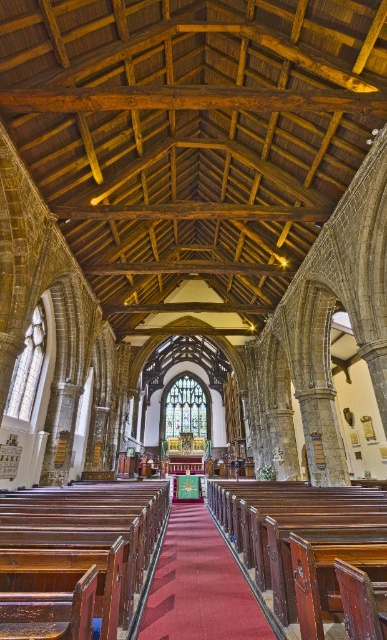
Question: Does polished wood church bench at center lie behind wooden polished bench at center?

Choices:
 (A) no
 (B) yes

Answer: (A)

Question: Is polished wood church bench at center to the left of wooden polished bench at center from the viewer's perspective?

Choices:
 (A) no
 (B) yes

Answer: (B)

Question: Which of the following is the farthest from the observer?

Choices:
 (A) wooden polished bench at center
 (B) polished wood church bench at center
 (C) smooth wooden aisle at center

Answer: (C)

Question: Based on their relative distances, which object is nearer to the wooden polished bench at center?

Choices:
 (A) smooth wooden aisle at center
 (B) polished wood church bench at center

Answer: (A)

Question: Which of these objects is positioned closest to the wooden polished bench at center?

Choices:
 (A) polished wood church bench at center
 (B) smooth wooden aisle at center

Answer: (B)

Question: Is polished wood church bench at center to the left of smooth wooden aisle at center from the viewer's perspective?

Choices:
 (A) no
 (B) yes

Answer: (B)